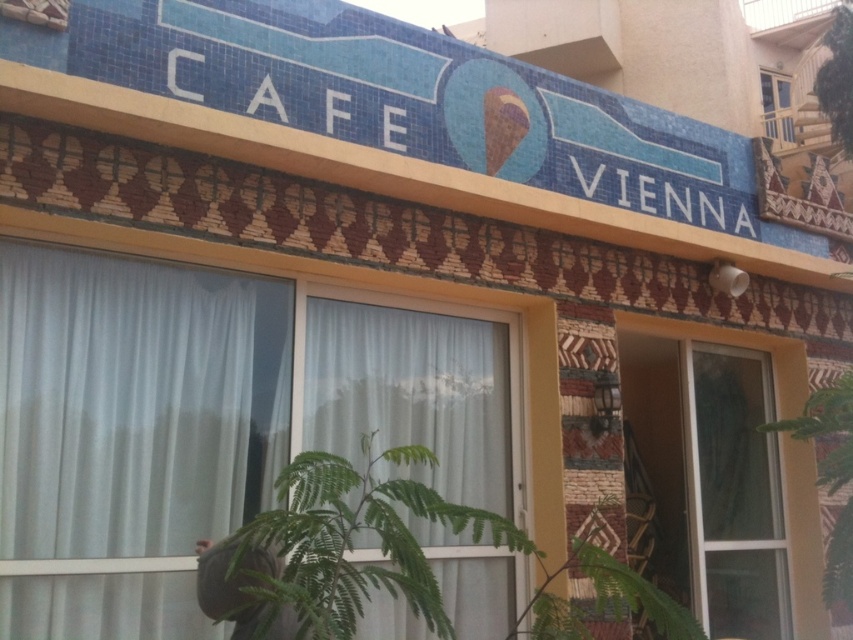
You are standing in front of the building and want to enter through the transparent glass door at center. Based on the coordinates provided, can you estimate the door location relative to the CAFE VIENNA sign?

The transparent glass door at center is located at coordinates point (x=728, y=470), which places it below the CAFE VIENNA sign on the building facade.

You are standing outside the building and notice the white sheer curtain at lower left and the clear glass window at upper right. Which object is positioned higher on the building?

The clear glass window at upper right is positioned higher on the building than the white sheer curtain at lower left.